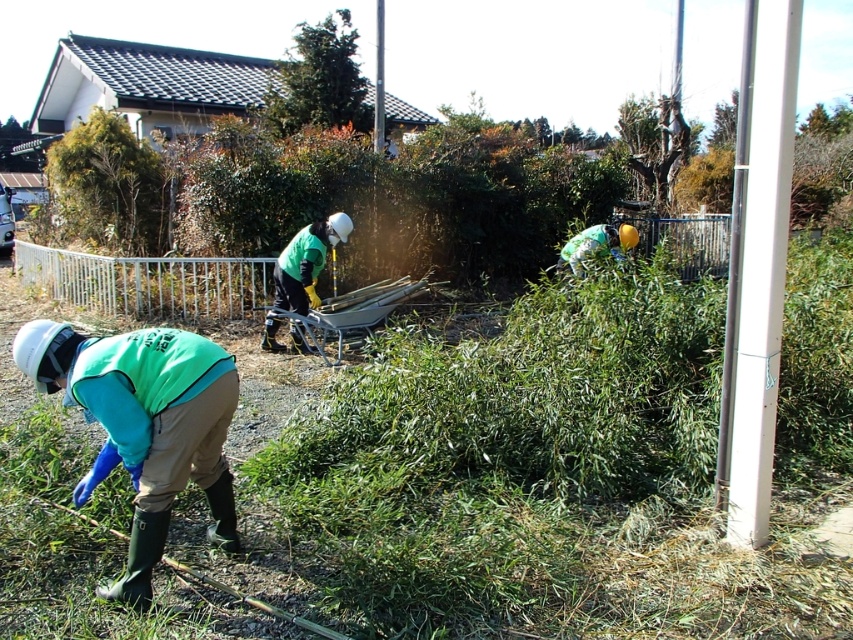
You are a safety inspector standing at the center of the scene. You need to check the safety distance between the green matte jacket at lower left and the nearest worker. Is the distance between them sufficient according to the safety regulation that requires at least 3 meters between workers?

The distance between the green matte jacket at lower left and the nearest worker is 3.06 meters, which meets the safety regulation requirement of at least 3 meters. Therefore, the distance is sufficient.

You are standing in the residential area with the traditional house. You see a point marked at coordinate (306, 262). What object does this point correspond to?

The point at coordinate (306, 262) corresponds to the green fabric jacket at center.

You are standing at the center of the image and want to locate the green matte jacket at lower left. Which direction should you look to find it?

The green matte jacket at lower left is located at the lower left direction from your current position at the center of the image.